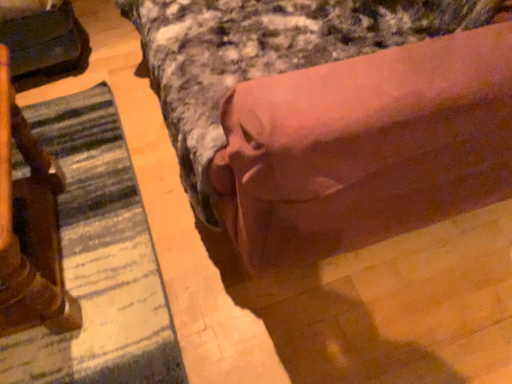
The image size is (512, 384). I want to click on free space to the right of wooden statue at left, so click(195, 261).